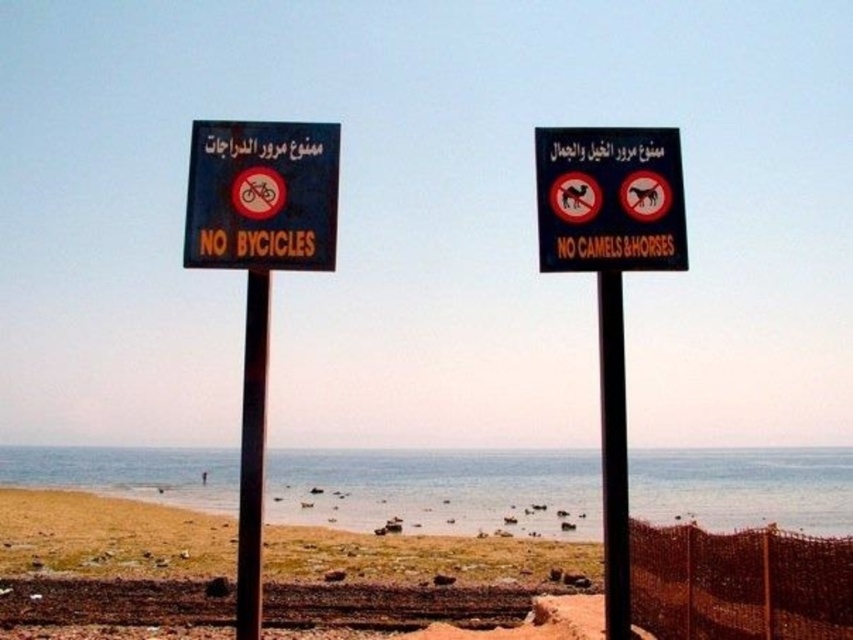
You are a cyclist trying to find a path to the beach. You see the black plastic signboard at left and the black metal pole at center. Which object is closer to the left edge of the image?

The black plastic signboard at left is positioned on the left side of the black metal pole at center, so it is closer to the left edge of the image.

You are standing at the center of the beach and want to place a new sign exactly where the black plastic signboard at left is located. What are the coordinates where you should place the new sign?

The coordinates for placing the new sign should be at point [260,195] where the black plastic signboard at left is located.